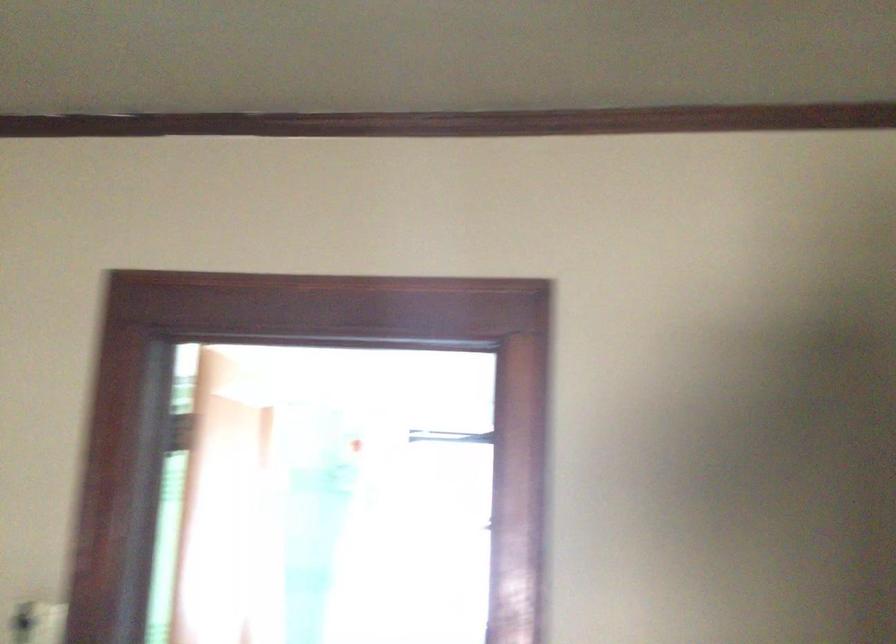
Where would you press the white light switch? Please return your answer as a coordinate pair (x, y).

(36, 623)